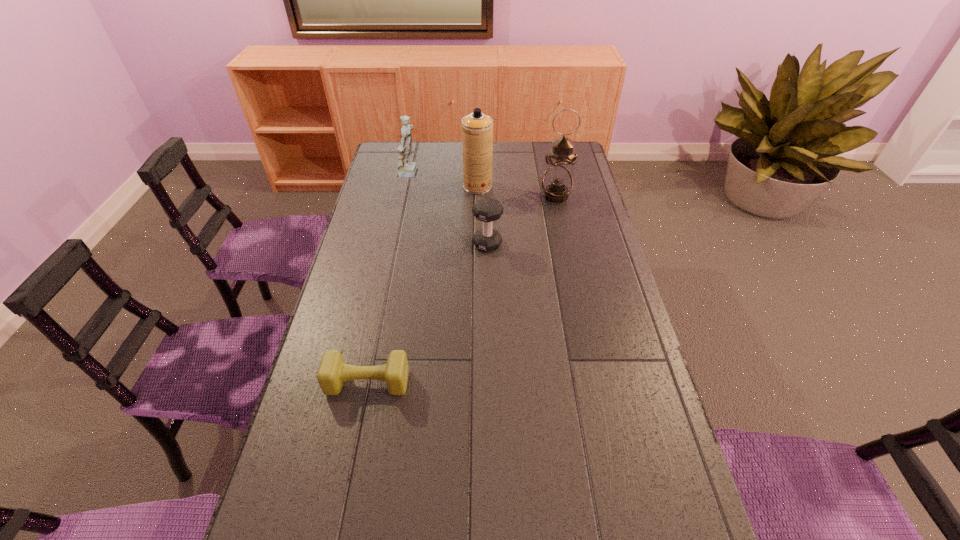
Find the location of a particular element. free location located on the right of the fourth tallest object is located at coordinates (567, 244).

Where is `vacant area located 0.300m on the right of the left dumbbell`? vacant area located 0.300m on the right of the left dumbbell is located at coordinates (522, 382).

In order to click on object that is at the far edge in this screenshot , I will do `click(406, 168)`.

The image size is (960, 540). In order to click on figurine situated at the left edge in this screenshot , I will do `click(406, 168)`.

Locate an element on the screen. This screenshot has height=540, width=960. dumbbell positioned at the left edge is located at coordinates (333, 371).

Locate an element on the screen. The height and width of the screenshot is (540, 960). object located at the right edge is located at coordinates (557, 182).

The height and width of the screenshot is (540, 960). What are the coordinates of `object that is at the far left corner` in the screenshot? It's located at (406, 168).

Locate an element on the screen. The image size is (960, 540). vacant space at the far edge of the desktop is located at coordinates (434, 147).

Locate an element on the screen. This screenshot has height=540, width=960. free region at the left edge is located at coordinates (383, 193).

Where is `vacant space at the right edge of the desktop`? This screenshot has width=960, height=540. vacant space at the right edge of the desktop is located at coordinates (592, 247).